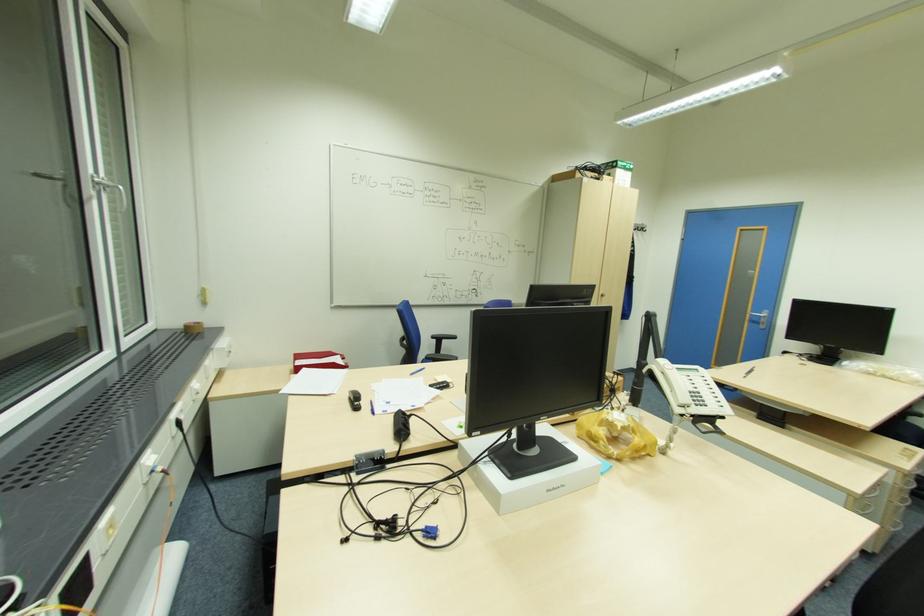
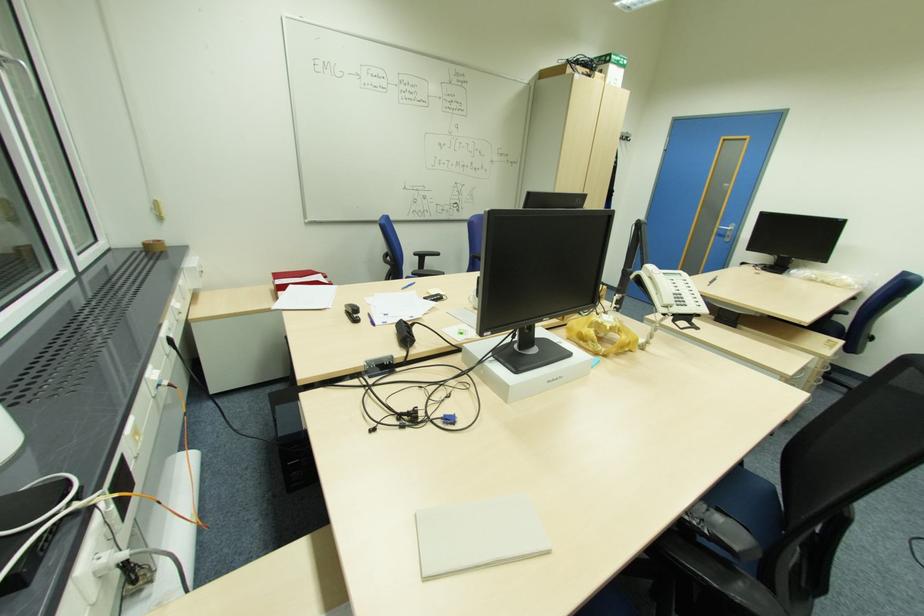
The point at (338, 354) is marked in the first image. Where is the corresponding point in the second image?

(320, 273)